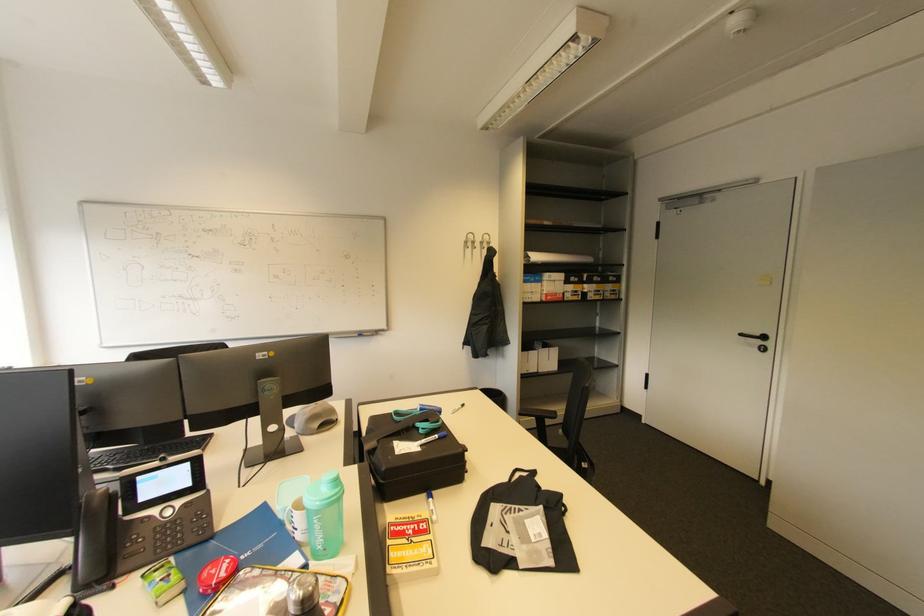
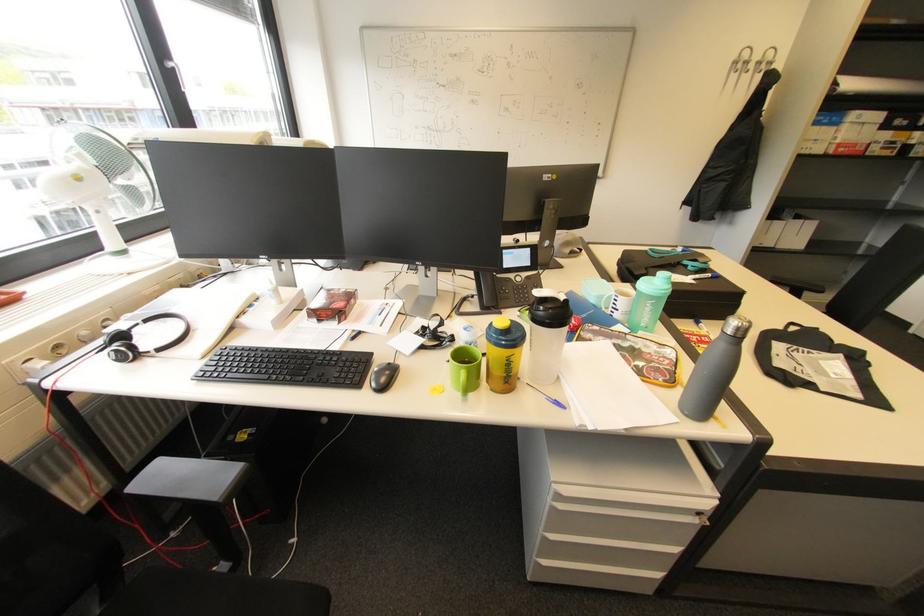
The point at (492, 238) is marked in the first image. Where is the corresponding point in the second image?

(775, 55)